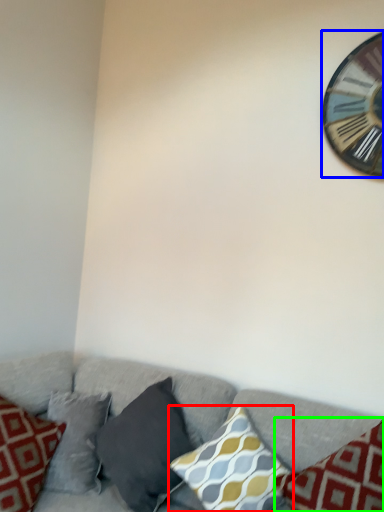
Question: Based on their relative distances, which object is nearer to pillow (highlighted by a red box)? Choose from wall clock (highlighted by a blue box) and pillow (highlighted by a green box).

Choices:
 (A) wall clock
 (B) pillow

Answer: (B)